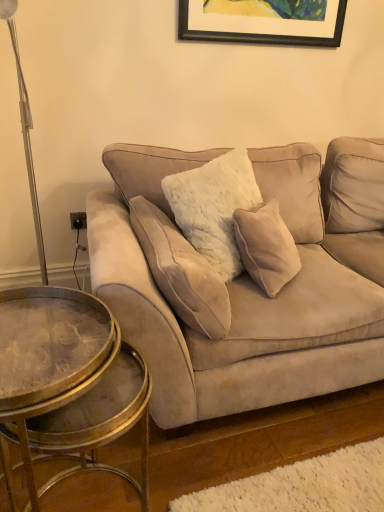
Question: Would you say velvet beige pillow at center contains metallic glass coffee table at lower left?

Choices:
 (A) yes
 (B) no

Answer: (B)

Question: Is velvet beige pillow at center shorter than metallic glass coffee table at lower left?

Choices:
 (A) yes
 (B) no

Answer: (A)

Question: Is velvet beige pillow at center thinner than metallic glass coffee table at lower left?

Choices:
 (A) yes
 (B) no

Answer: (A)

Question: Is velvet beige pillow at center oriented away from metallic glass coffee table at lower left?

Choices:
 (A) no
 (B) yes

Answer: (B)

Question: From the image's perspective, is velvet beige pillow at center beneath metallic glass coffee table at lower left?

Choices:
 (A) yes
 (B) no

Answer: (B)

Question: Based on their sizes in the image, would you say suede couch at center is bigger or smaller than metallic glass coffee table at lower left?

Choices:
 (A) small
 (B) big

Answer: (B)

Question: From the image's perspective, is suede couch at center positioned above or below metallic glass coffee table at lower left?

Choices:
 (A) above
 (B) below

Answer: (A)

Question: Is point (258, 368) closer or farther from the camera than point (51, 345)?

Choices:
 (A) farther
 (B) closer

Answer: (A)

Question: In the image, is suede couch at center positioned in front of or behind metallic glass coffee table at lower left?

Choices:
 (A) behind
 (B) front

Answer: (A)

Question: Relative to velvet beige pillow at center, is metallic glass coffee table at lower left in front or behind?

Choices:
 (A) behind
 (B) front

Answer: (B)

Question: From the image's perspective, is metallic glass coffee table at lower left above or below velvet beige pillow at center?

Choices:
 (A) above
 (B) below

Answer: (B)

Question: Considering the positions of metallic glass coffee table at lower left and velvet beige pillow at center in the image, is metallic glass coffee table at lower left taller or shorter than velvet beige pillow at center?

Choices:
 (A) short
 (B) tall

Answer: (B)

Question: Do you think metallic glass coffee table at lower left is within velvet beige pillow at center, or outside of it?

Choices:
 (A) outside
 (B) inside

Answer: (A)

Question: In terms of height, does velvet beige pillow at center look taller or shorter compared to suede couch at center?

Choices:
 (A) tall
 (B) short

Answer: (B)

Question: In the image, is velvet beige pillow at center on the left side or the right side of suede couch at center?

Choices:
 (A) right
 (B) left

Answer: (B)